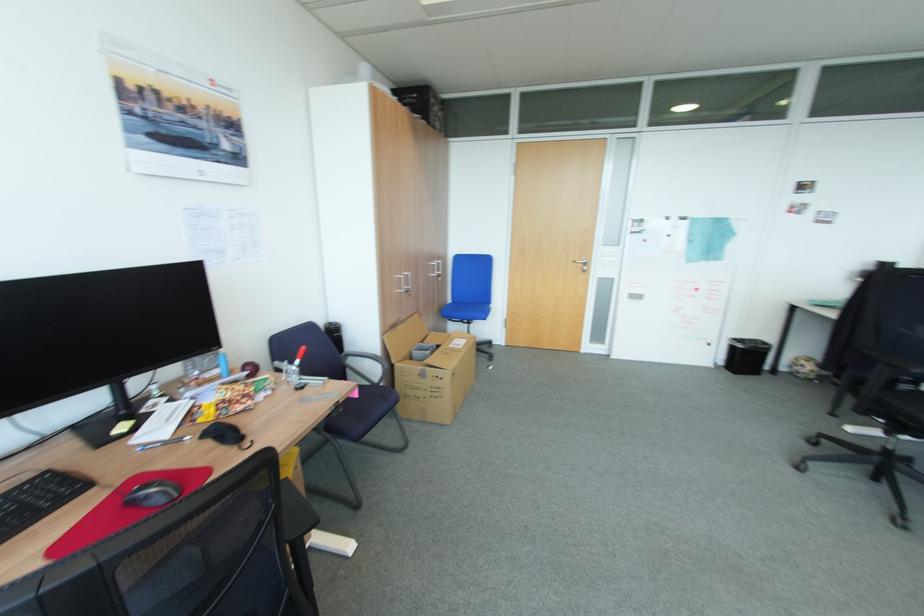
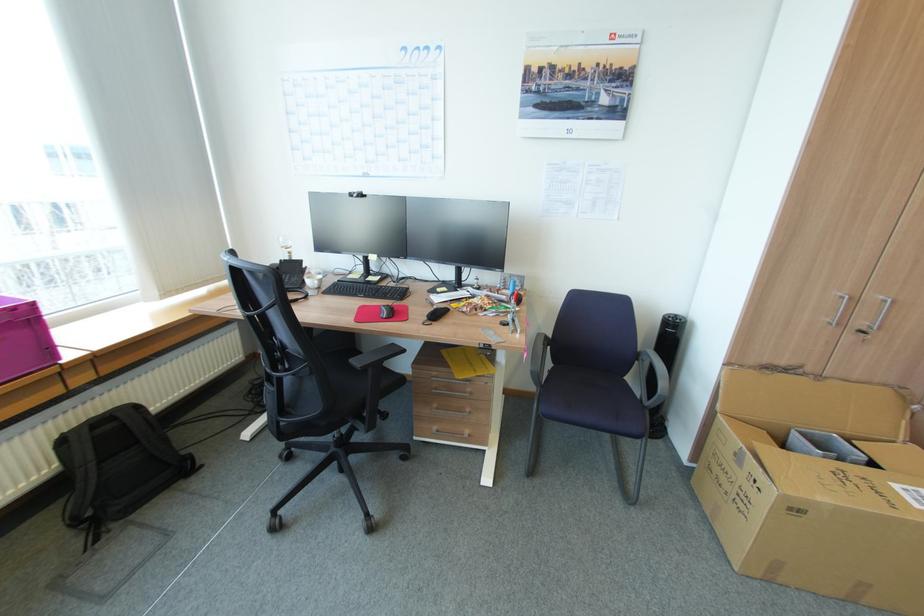
Where in the second image is the point corresponding to point (411, 292) from the first image?

(868, 331)